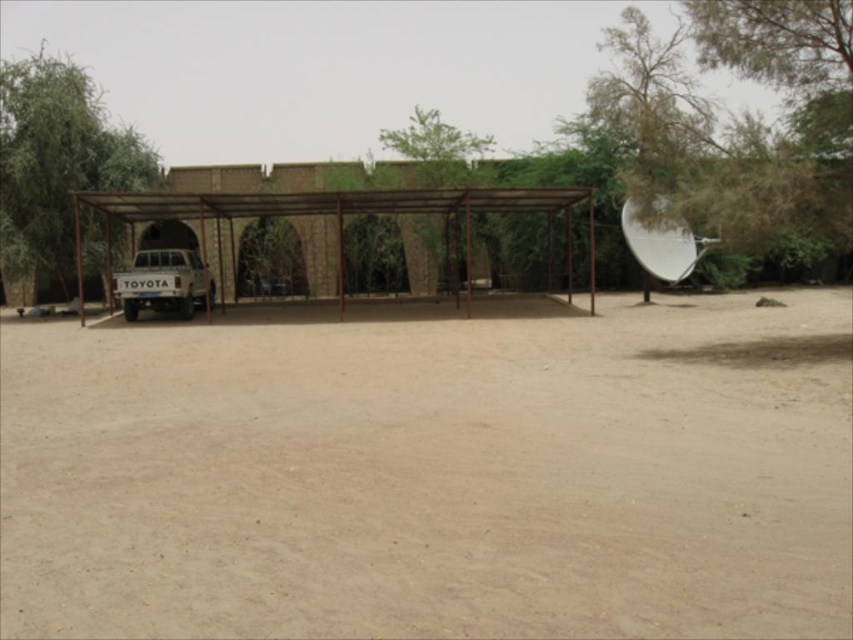
You are standing in the desert and see the brown metal carport at center and the green leafy tree at center. Which object is closer to you?

The brown metal carport at center is closer to you because it is in front of the green leafy tree at center.

You are standing at the entrance of the arched brick building and want to walk to the green leafy tree at left. Which direction should you head towards?

The green leafy tree at left is located at point (56, 161), so you should head towards the left direction to reach it.